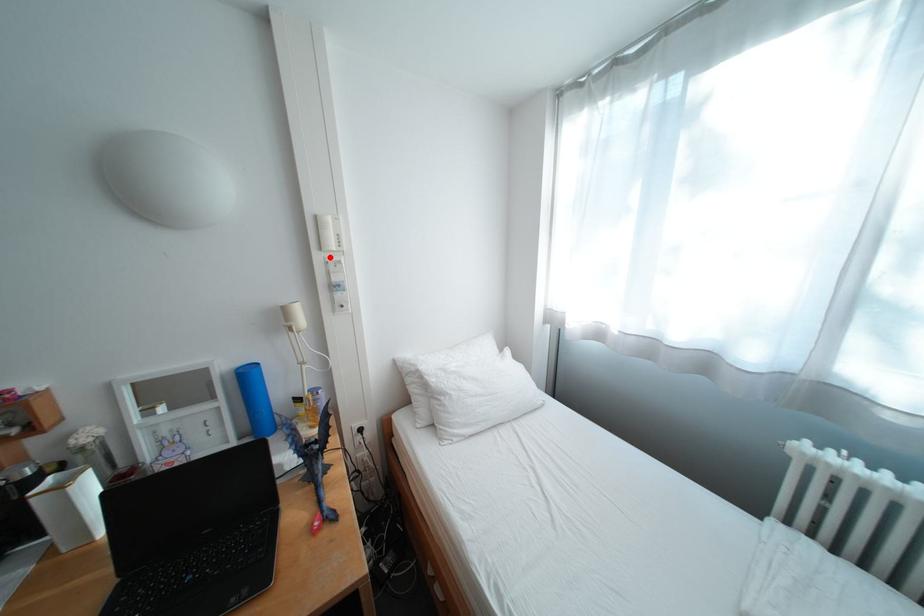
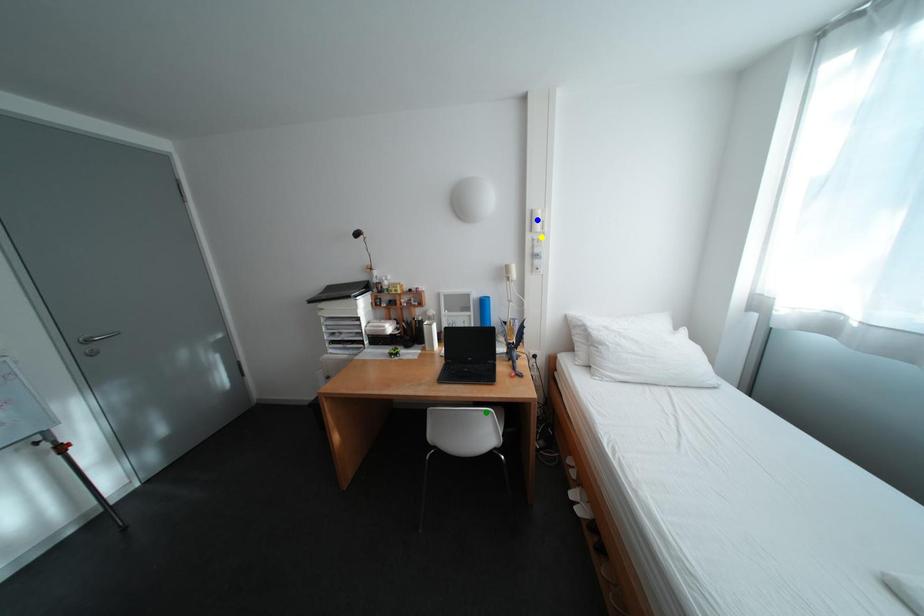
Question: I am providing you with two images of the same scene from different viewpoints. A red point is marked on the first image. You are given multiple points on the second image. Which spot in image 2 lines up with the point in image 1?

Choices:
 (A) yellow point
 (B) green point
 (C) blue point

Answer: (A)